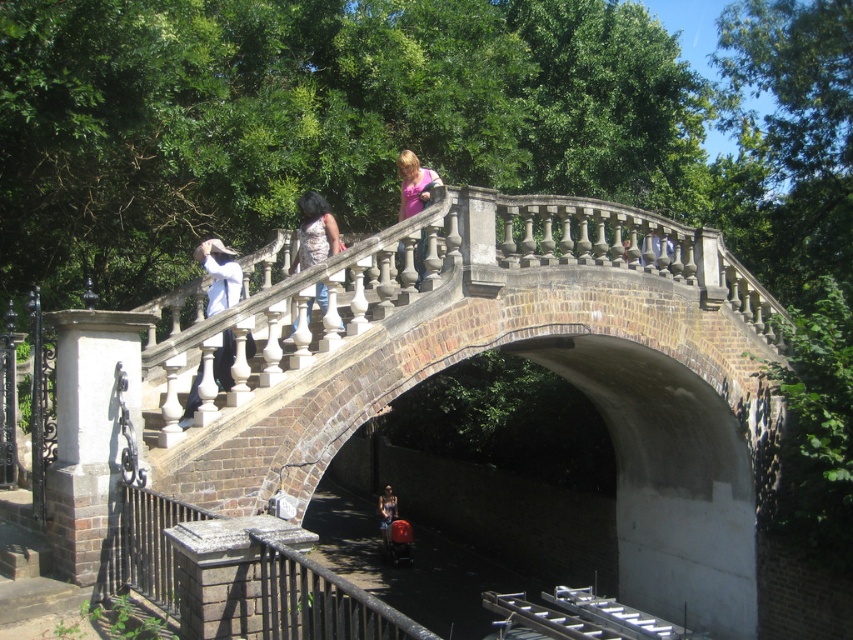
You are a photographer trying to capture a shot of the white matte pants at upper center and dark blue jeans at center. Which object is positioned higher in the frame?

The white matte pants at upper center is positioned higher than the dark blue jeans at center.